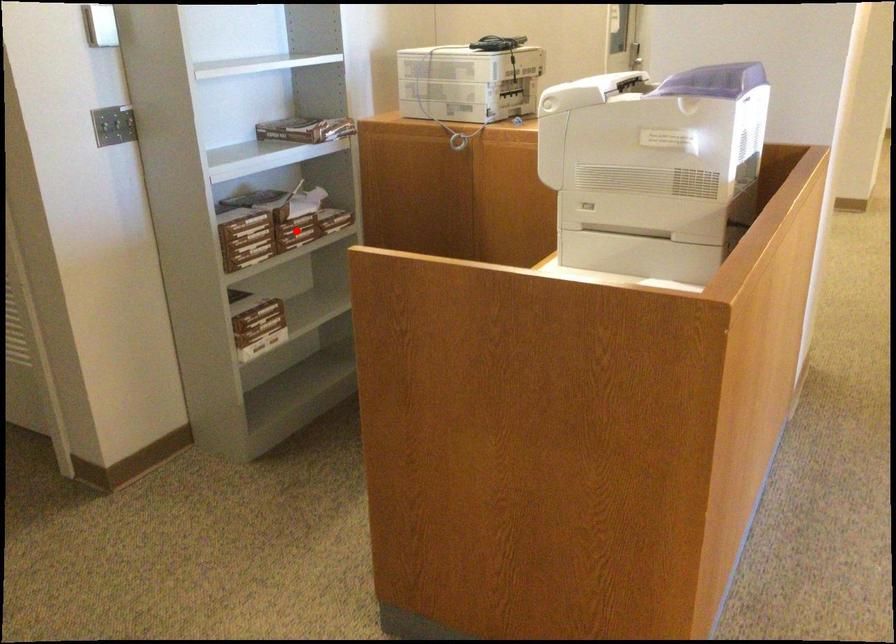
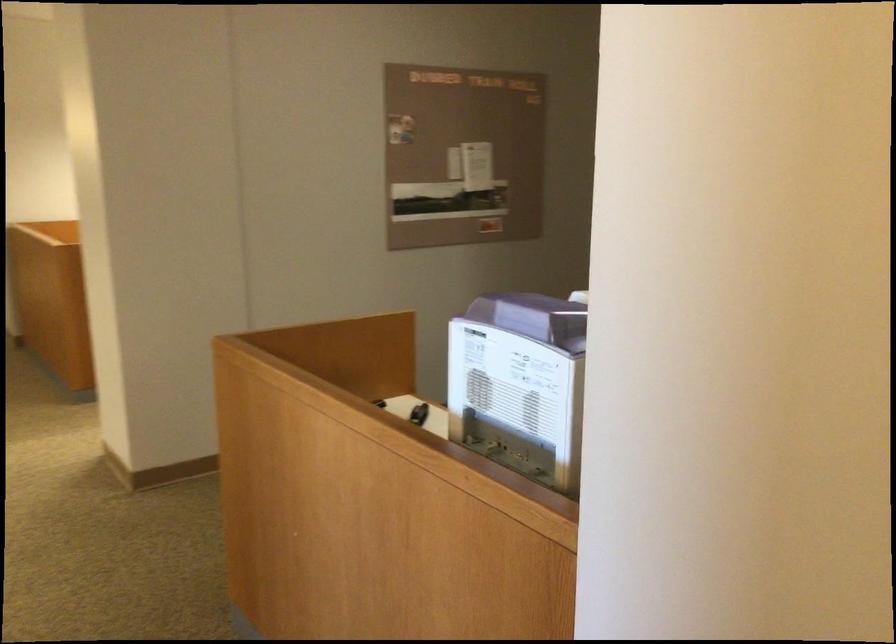
Question: I am providing you with two images of the same scene from different viewpoints. A red point is marked on the first image. Is the red point's position out of view in image 2?

Choices:
 (A) Yes
 (B) No

Answer: (A)